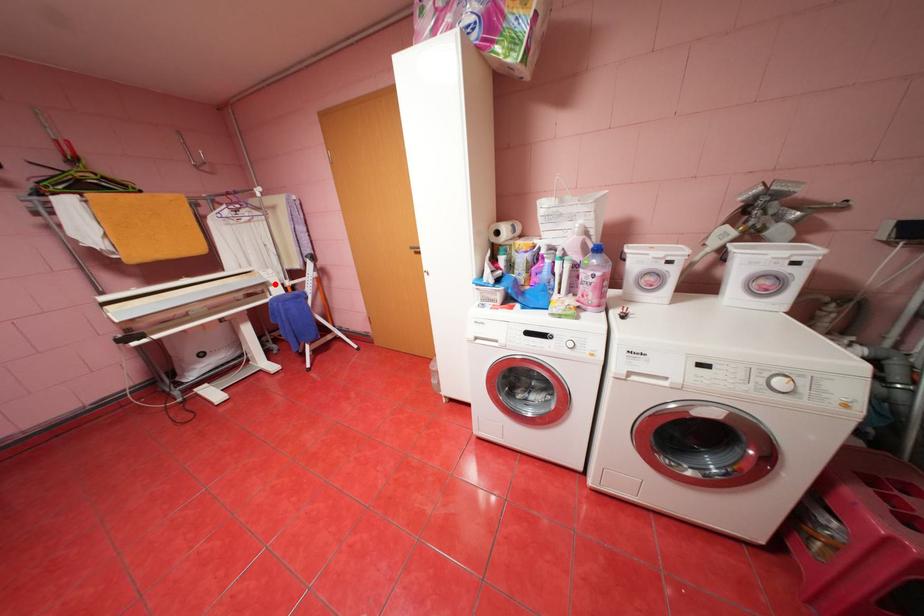
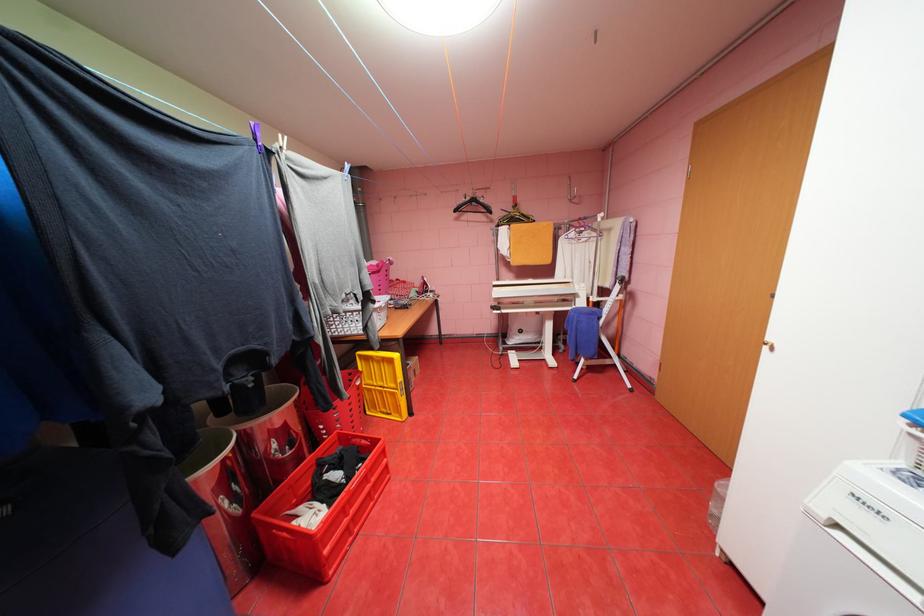
Locate, in the second image, the point that corresponds to the highlighted location in the first image.

(584, 294)